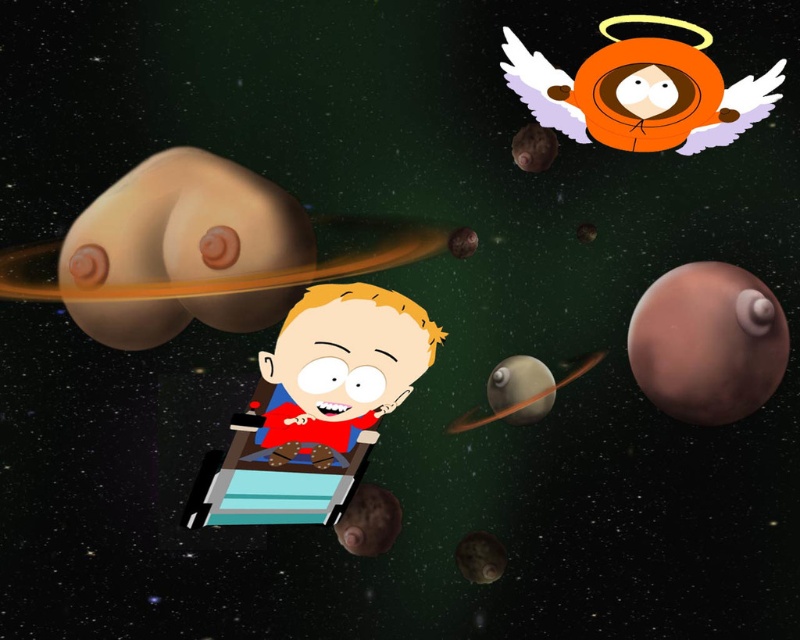
You are an astronaut in a spaceship traveling through space. You see two planets ahead, the smooth beige planet at left and the smooth brown planet at center. Which planet should you choose to land on if you want to land on the bigger one?

The smooth beige planet at left is larger in size than the smooth brown planet at center, so you should choose to land on the smooth beige planet at left.